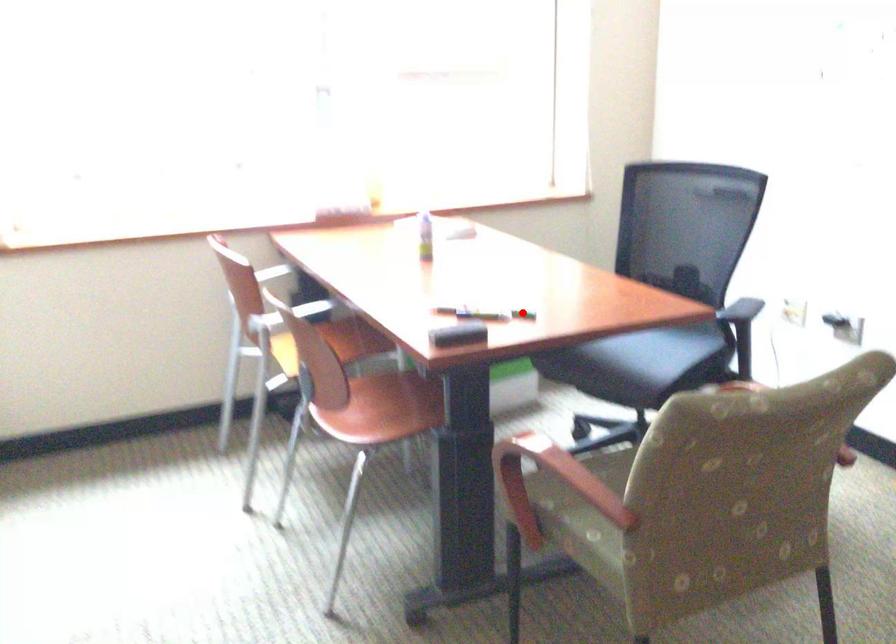
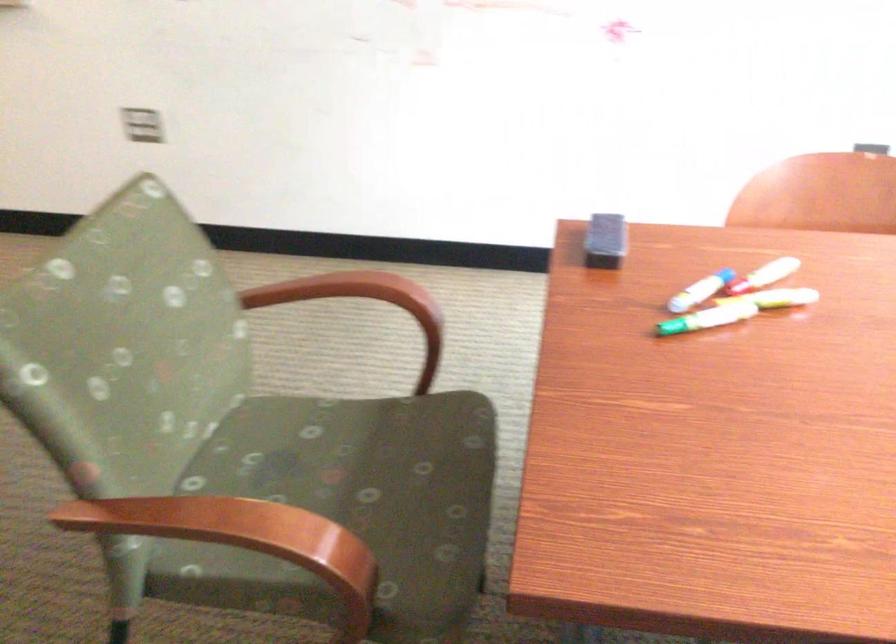
Question: I am providing you with two images of the same scene from different viewpoints. A red point is shown in image1. For the corresponding object point in image2, is it positioned nearer or farther from the camera?

Choices:
 (A) Nearer
 (B) Farther

Answer: (A)